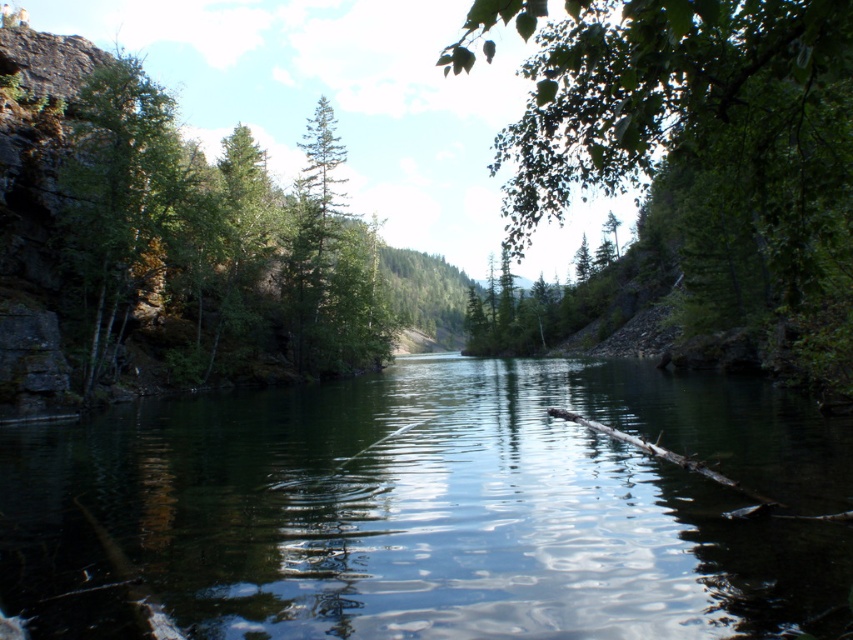
You are standing at the edge of the water and want to walk towards the green leafy tree at center and the green leafy tree at left. Which tree will you reach first?

You will reach the green leafy tree at center first because it is closer to you than the green leafy tree at left.

You are standing at the edge of the water and see the green leafy tree at center and the green leafy tree at left. Which tree is closer to the water?

The green leafy tree at left is closer to the water because the green leafy tree at center is above it, meaning it is positioned higher up and farther away from the water level.